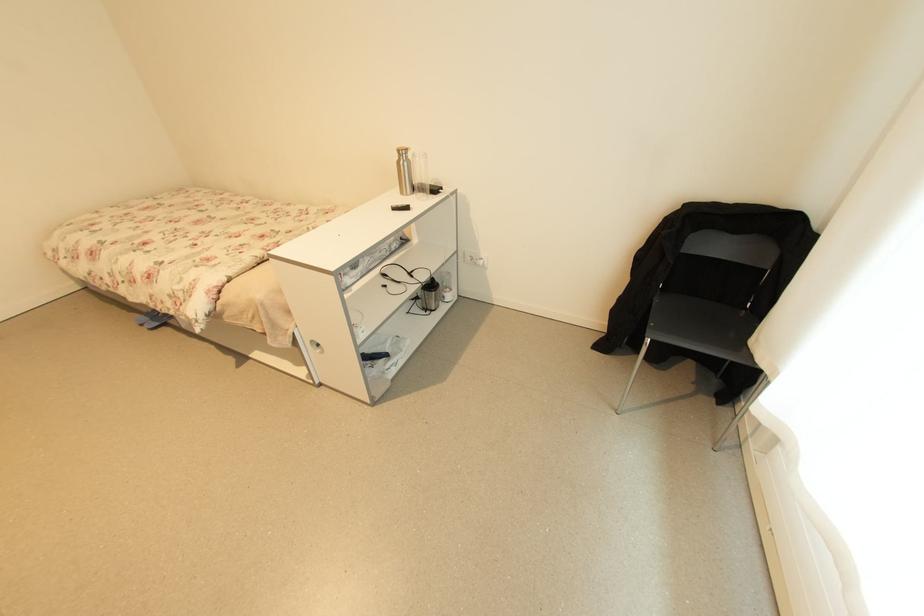
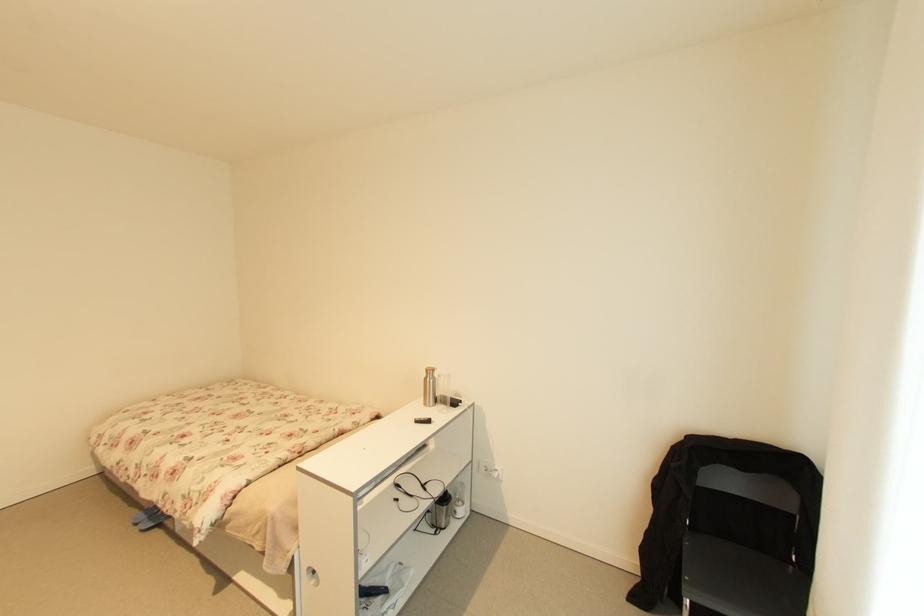
Question: The images are taken continuously from a first-person perspective. In which direction is your viewpoint rotating?

Choices:
 (A) Left
 (B) Right
 (C) Up
 (D) Down

Answer: (C)